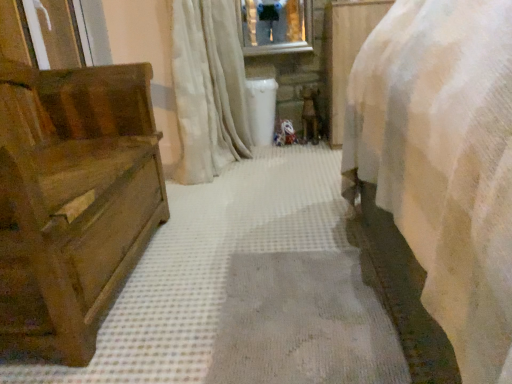
Question: Based on their sizes in the image, would you say white soft curtain at center is bigger or smaller than wooden chest at left?

Choices:
 (A) small
 (B) big

Answer: (A)

Question: From a real-world perspective, is white soft curtain at center above or below wooden chest at left?

Choices:
 (A) below
 (B) above

Answer: (B)

Question: From the image's perspective, is white soft curtain at center above or below wooden chest at left?

Choices:
 (A) above
 (B) below

Answer: (A)

Question: Is point (135, 66) positioned closer to the camera than point (181, 51)?

Choices:
 (A) closer
 (B) farther

Answer: (A)

Question: Considering the positions of wooden chest at left and white soft curtain at center in the image, is wooden chest at left bigger or smaller than white soft curtain at center?

Choices:
 (A) small
 (B) big

Answer: (B)

Question: Is wooden chest at left situated inside white soft curtain at center or outside?

Choices:
 (A) inside
 (B) outside

Answer: (B)

Question: From the image's perspective, is wooden chest at left above or below white soft curtain at center?

Choices:
 (A) above
 (B) below

Answer: (B)